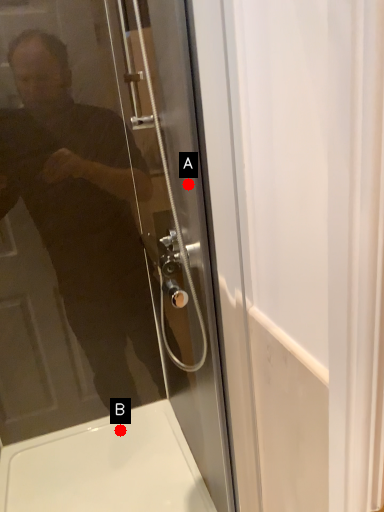
Question: Two points are circled on the image, labeled by A and B beside each circle. Which point appears closest to the camera in this image?

Choices:
 (A) A is closer
 (B) B is closer

Answer: (A)